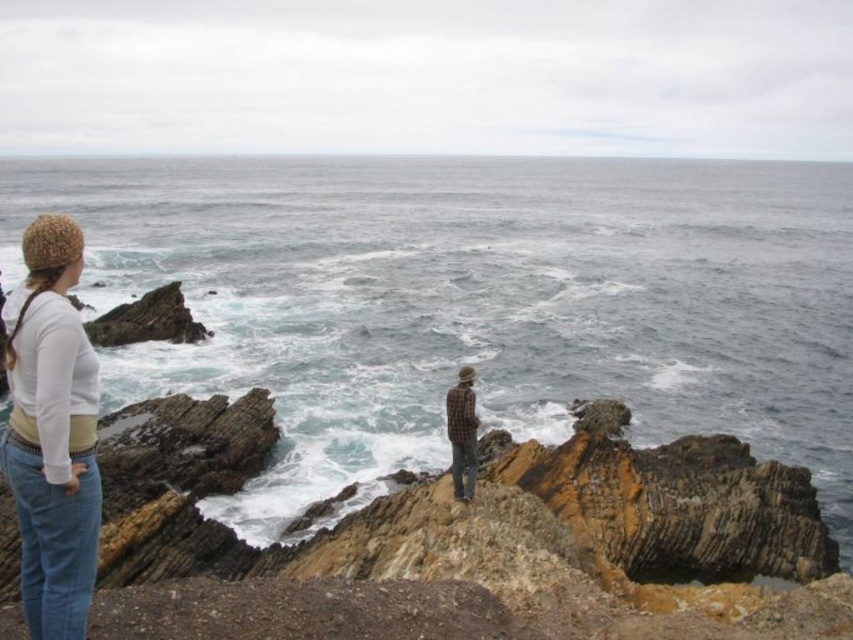
Can you confirm if dark blue water at center is thinner than matte white sweater at left?

In fact, dark blue water at center might be wider than matte white sweater at left.

Identify the location of dark blue water at center. The width and height of the screenshot is (853, 640). (473, 301).